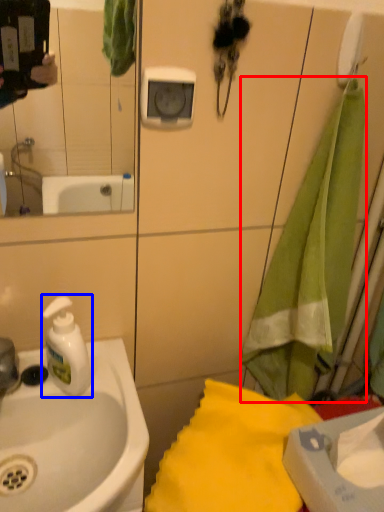
Question: Among these objects, which one is farthest to the camera, beach towel (highlighted by a red box) or soap dispenser (highlighted by a blue box)?

Choices:
 (A) beach towel
 (B) soap dispenser

Answer: (B)